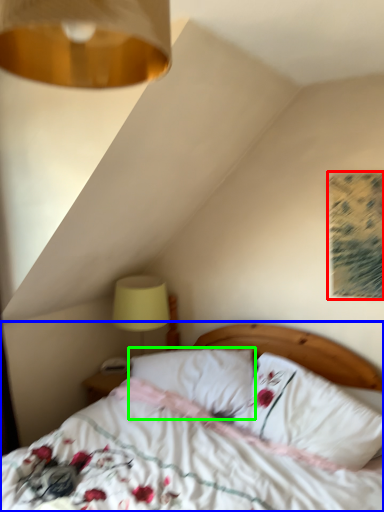
Question: Which object is positioned closest to print (highlighted by a red box)? Select from bed (highlighted by a blue box) and pillow (highlighted by a green box).

Choices:
 (A) bed
 (B) pillow

Answer: (B)